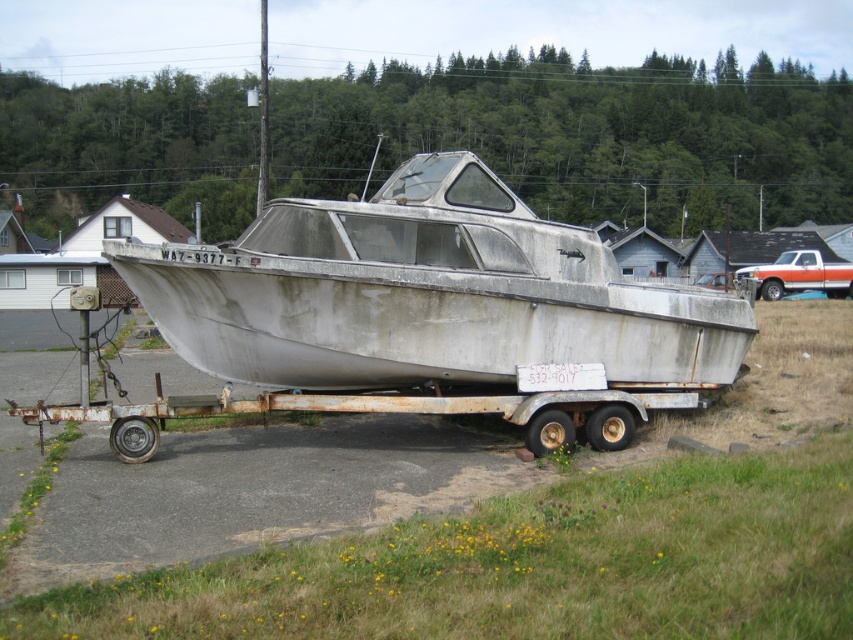
What is the relationship between the rusty aluminum boat at center and the rusty metal trailer at center in terms of their positions?

The rusty aluminum boat at center is positioned in front of the rusty metal trailer at center.

What is the location of the point with coordinates (426, 296) in the scene?

The point with coordinates (426, 296) is on the rusty aluminum boat at center.

You are a potential buyer standing at the edge of the trailer, looking at the rusty aluminum boat at center. What is the exact location of the boat in relation to the trailer?

The rusty aluminum boat at center is located at point (426, 296) relative to the trailer.